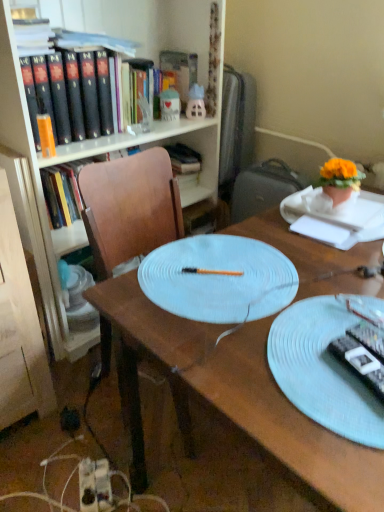
What are the coordinates of `vacant space that is to the left of black plastic remote control at right, the first remote control from the right` in the screenshot? It's located at (298, 368).